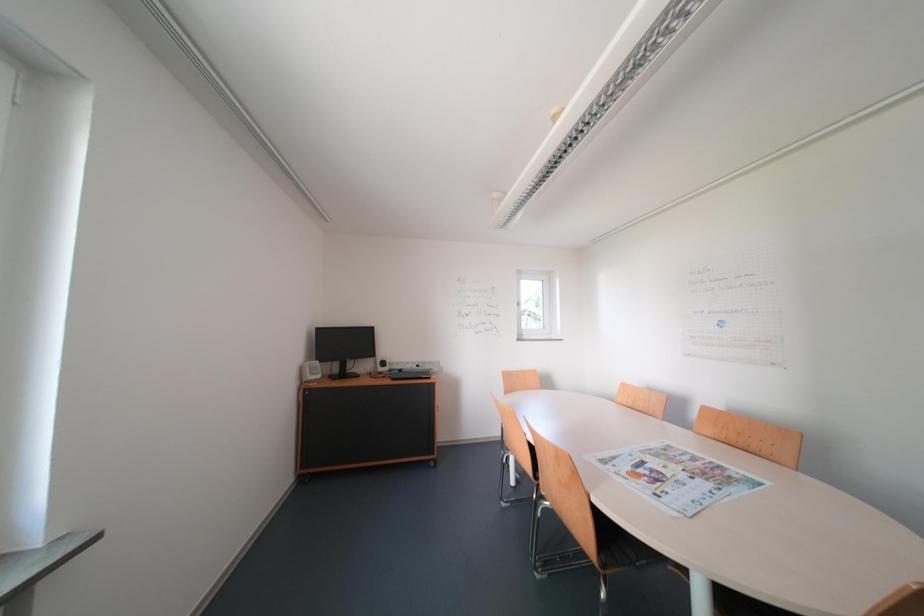
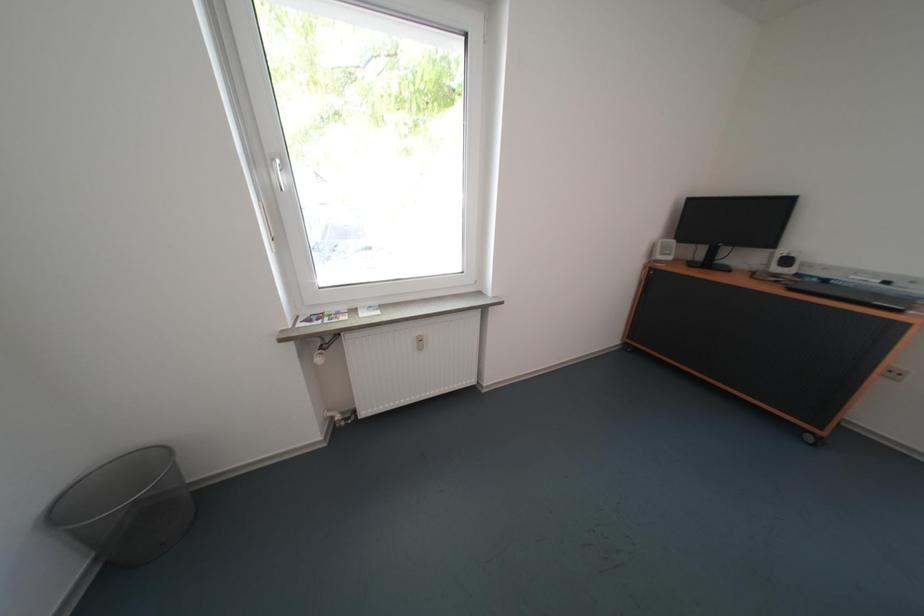
The first image is from the beginning of the video and the second image is from the end. How did the camera likely rotate when shooting the video?

The camera's rotation is toward left-down.